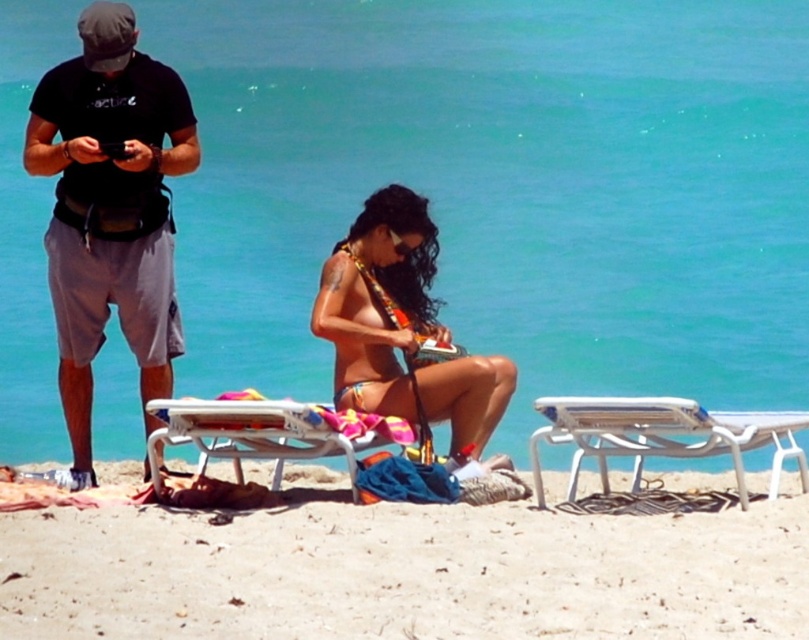
Question: Considering the relative positions of beige sand at lower center and white plastic beach chair at center in the image provided, where is beige sand at lower center located with respect to white plastic beach chair at center?

Choices:
 (A) above
 (B) below

Answer: (B)

Question: Which object appears closest to the camera in this image?

Choices:
 (A) beige sand at lower center
 (B) turquoise water at center
 (C) white plastic chair at lower right
 (D) white plastic beach chair at center

Answer: (A)

Question: Which of the following is the farthest from the observer?

Choices:
 (A) multicolored bikini at center
 (B) white plastic chair at lower right
 (C) white plastic beach chair at center
 (D) turquoise water at center

Answer: (A)

Question: Is black cotton t-shirt at upper left below white plastic chair at lower right?

Choices:
 (A) no
 (B) yes

Answer: (A)

Question: Which point is farther to the camera?

Choices:
 (A) (807, 412)
 (B) (282, 428)
 (C) (452, 109)

Answer: (C)

Question: Is multicolored bikini at center to the left of white plastic beach chair at center from the viewer's perspective?

Choices:
 (A) yes
 (B) no

Answer: (B)